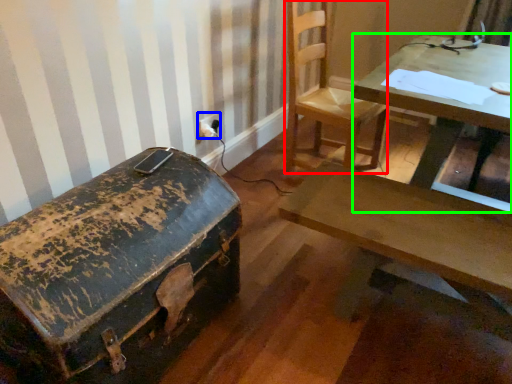
Question: Which is nearer to the chair (highlighted by a red box)? electric outlet (highlighted by a blue box) or table (highlighted by a green box).

Choices:
 (A) electric outlet
 (B) table

Answer: (B)